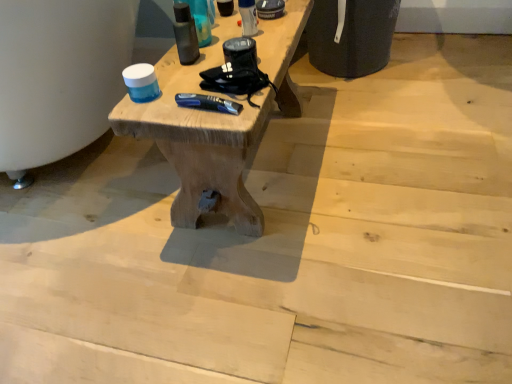
In order to face wooden table at center, should I rotate leftwards or rightwards?

Rotate your view left by about 1.796°.

What do you see at coordinates (216, 121) in the screenshot?
I see `wooden table at center` at bounding box center [216, 121].

Where is `wooden table at center`? wooden table at center is located at coordinates (216, 121).

Locate an element on the screen. wooden table at center is located at coordinates (216, 121).